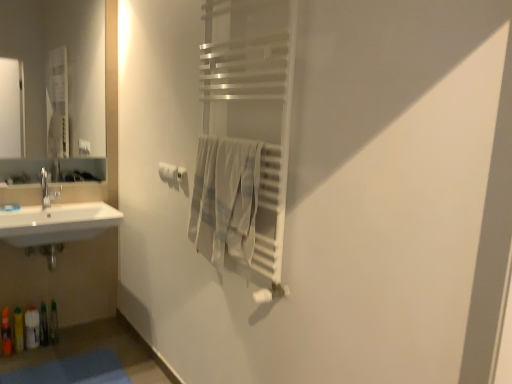
Question: From the image's perspective, is satin silver towel rack at center beneath light beige cotton towel at center?

Choices:
 (A) no
 (B) yes

Answer: (A)

Question: From a real-world perspective, does satin silver towel rack at center sit lower than light beige cotton towel at center?

Choices:
 (A) no
 (B) yes

Answer: (A)

Question: From the image's perspective, does satin silver towel rack at center appear higher than light beige cotton towel at center?

Choices:
 (A) yes
 (B) no

Answer: (A)

Question: From a real-world perspective, is satin silver towel rack at center located higher than light beige cotton towel at center?

Choices:
 (A) yes
 (B) no

Answer: (A)

Question: Is satin silver towel rack at center in contact with light beige cotton towel at center?

Choices:
 (A) no
 (B) yes

Answer: (B)

Question: Considering the positions of point (207, 137) and point (20, 380), is point (207, 137) closer or farther from the camera than point (20, 380)?

Choices:
 (A) farther
 (B) closer

Answer: (B)

Question: Considering the positions of light beige cotton towel at center and blue fabric bath mat at lower left in the image, is light beige cotton towel at center taller or shorter than blue fabric bath mat at lower left?

Choices:
 (A) short
 (B) tall

Answer: (B)

Question: From the image's perspective, is light beige cotton towel at center above or below blue fabric bath mat at lower left?

Choices:
 (A) below
 (B) above

Answer: (B)

Question: Looking at their shapes, would you say light beige cotton towel at center is wider or thinner than blue fabric bath mat at lower left?

Choices:
 (A) thin
 (B) wide

Answer: (A)

Question: From their relative heights in the image, would you say satin nickel towel bar at center is taller or shorter than translucent plastic bottles at lower left, the 3th toiletry in the right-to-left sequence?

Choices:
 (A) tall
 (B) short

Answer: (B)

Question: Looking at their shapes, would you say satin nickel towel bar at center is wider or thinner than translucent plastic bottles at lower left, which is the 2th toiletry in left-to-right order?

Choices:
 (A) wide
 (B) thin

Answer: (B)

Question: From a real-world perspective, relative to translucent plastic bottles at lower left, which is the 2th toiletry in left-to-right order, is satin nickel towel bar at center vertically above or below?

Choices:
 (A) above
 (B) below

Answer: (A)

Question: Considering the relative positions of satin nickel towel bar at center and translucent plastic bottles at lower left, the 3th toiletry in the right-to-left sequence, in the image provided, is satin nickel towel bar at center to the left or to the right of translucent plastic bottles at lower left, the 3th toiletry in the right-to-left sequence,?

Choices:
 (A) right
 (B) left

Answer: (A)

Question: Is white matte toilet paper at center bigger or smaller than translucent plastic bottle at lower left, placed as the 4th toiletry when sorted from right to left?

Choices:
 (A) small
 (B) big

Answer: (A)

Question: In the image, is white matte toilet paper at center positioned in front of or behind translucent plastic bottle at lower left, placed as the 4th toiletry when sorted from right to left?

Choices:
 (A) front
 (B) behind

Answer: (A)